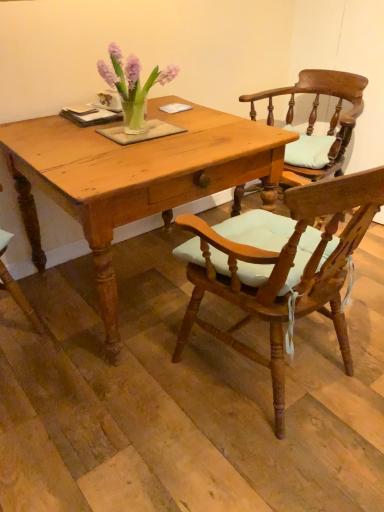
Question: Should I look upward or downward to see wooden chair with cushion at center, which is counted as the second chair, starting from the front?

Choices:
 (A) up
 (B) down

Answer: (A)

Question: From the image's perspective, is wooden chair with cushion at center, placed as the 1th chair when sorted from back to front, over wooden chair with light blue cushion at center, which appears as the first chair when viewed from the front?

Choices:
 (A) yes
 (B) no

Answer: (A)

Question: Is the depth of wooden chair with cushion at center, placed as the 1th chair when sorted from back to front, greater than that of wooden chair with light blue cushion at center, which ranks as the second chair in back-to-front order?

Choices:
 (A) yes
 (B) no

Answer: (A)

Question: From the image's perspective, is wooden chair with cushion at center, placed as the 1th chair when sorted from back to front, beneath wooden chair with light blue cushion at center, which ranks as the second chair in back-to-front order?

Choices:
 (A) no
 (B) yes

Answer: (A)

Question: Is wooden chair with cushion at center, which is counted as the second chair, starting from the front, shorter than wooden chair with light blue cushion at center, which appears as the first chair when viewed from the front?

Choices:
 (A) no
 (B) yes

Answer: (B)

Question: Can you confirm if wooden chair with cushion at center, placed as the 1th chair when sorted from back to front, is smaller than wooden chair with light blue cushion at center, which ranks as the second chair in back-to-front order?

Choices:
 (A) yes
 (B) no

Answer: (A)

Question: Is wooden chair with cushion at center, which is counted as the second chair, starting from the front, at the left side of wooden chair with light blue cushion at center, which appears as the first chair when viewed from the front?

Choices:
 (A) yes
 (B) no

Answer: (B)

Question: Considering the relative sizes of light brown wooden table at center and wooden chair with light blue cushion at center, which appears as the first chair when viewed from the front, in the image provided, is light brown wooden table at center bigger than wooden chair with light blue cushion at center, which appears as the first chair when viewed from the front,?

Choices:
 (A) yes
 (B) no

Answer: (A)

Question: Is light brown wooden table at center wider than wooden chair with light blue cushion at center, which appears as the first chair when viewed from the front?

Choices:
 (A) yes
 (B) no

Answer: (A)

Question: Can you confirm if light brown wooden table at center is thinner than wooden chair with light blue cushion at center, which appears as the first chair when viewed from the front?

Choices:
 (A) yes
 (B) no

Answer: (B)

Question: From a real-world perspective, is light brown wooden table at center on top of wooden chair with light blue cushion at center, which ranks as the second chair in back-to-front order?

Choices:
 (A) yes
 (B) no

Answer: (B)

Question: Considering the relative sizes of light brown wooden table at center and wooden chair with light blue cushion at center, which ranks as the second chair in back-to-front order, in the image provided, is light brown wooden table at center shorter than wooden chair with light blue cushion at center, which ranks as the second chair in back-to-front order,?

Choices:
 (A) yes
 (B) no

Answer: (A)

Question: Can you confirm if light brown wooden table at center is taller than wooden chair with light blue cushion at center, which ranks as the second chair in back-to-front order?

Choices:
 (A) no
 (B) yes

Answer: (A)

Question: From the image's perspective, is wooden chair with light blue cushion at center, which ranks as the second chair in back-to-front order, beneath light brown wooden table at center?

Choices:
 (A) no
 (B) yes

Answer: (B)